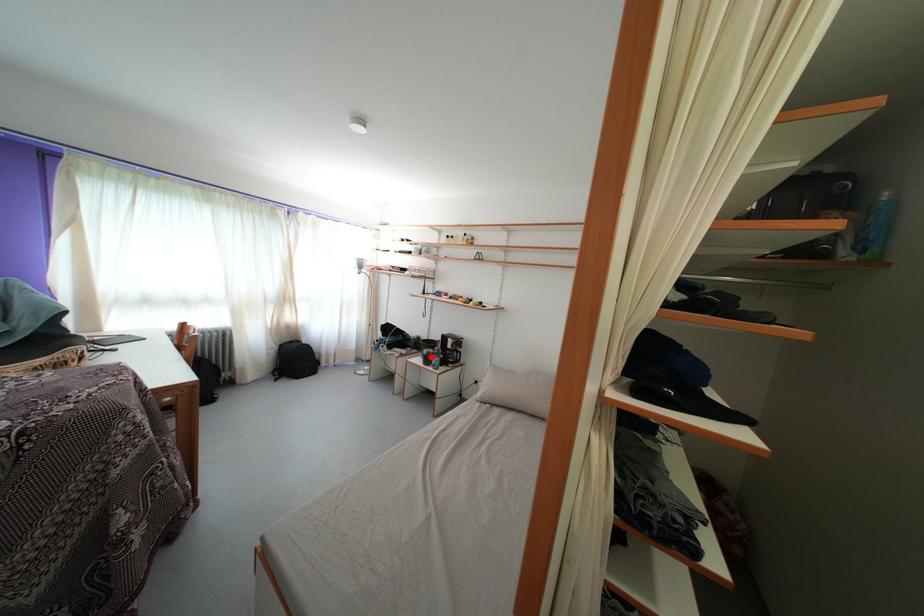
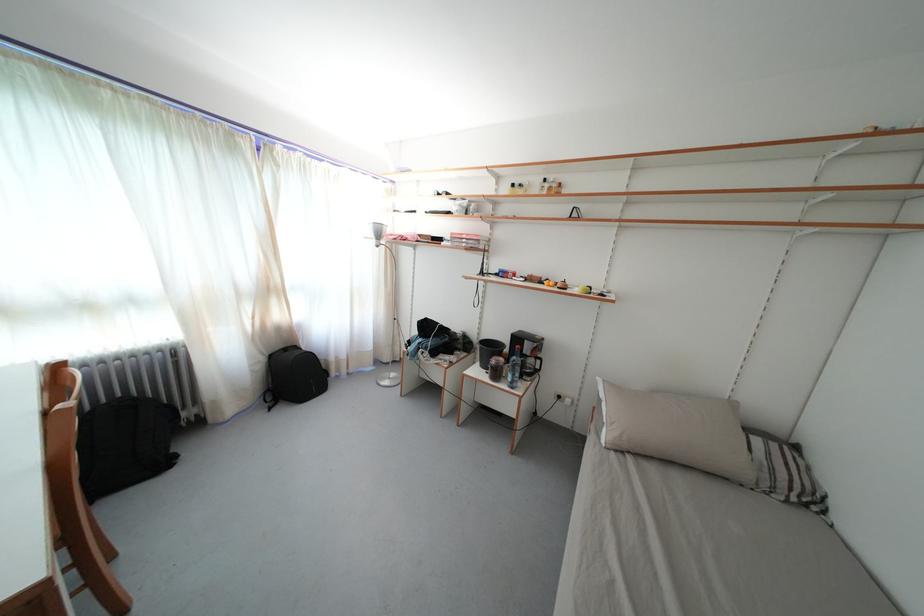
Question: I am providing you with two images of the same scene from different viewpoints. A red point is shown in image1. For the corresponding object point in image2, is it positioned nearer or farther from the camera?

Choices:
 (A) Nearer
 (B) Farther

Answer: (A)